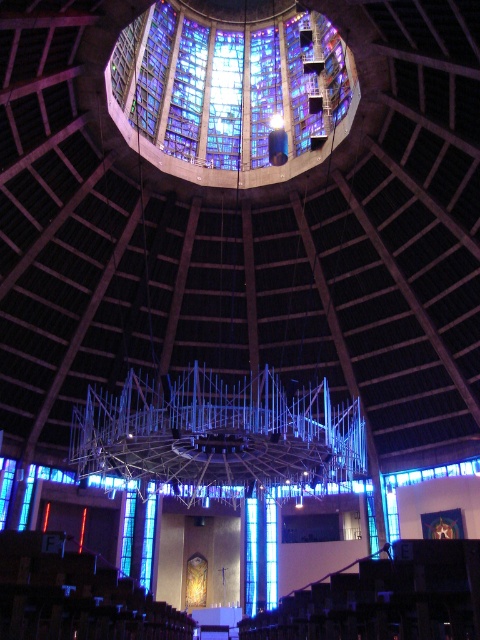
Question: Which of the following is the closest to the observer?

Choices:
 (A) transparent glass window at center
 (B) blue glass window at center
 (C) stained glass at center

Answer: (C)

Question: Is stained glass at center to the left of blue glass window at center from the viewer's perspective?

Choices:
 (A) no
 (B) yes

Answer: (A)

Question: Does stained glass at center have a larger size compared to blue glass window at center?

Choices:
 (A) no
 (B) yes

Answer: (B)

Question: Among these points, which one is farthest from the camera?

Choices:
 (A) (146, 547)
 (B) (291, 26)
 (C) (265, 522)

Answer: (B)

Question: Which point is closer to the camera?

Choices:
 (A) blue glass window at center
 (B) stained glass at center

Answer: (B)

Question: Can you confirm if stained glass at center is positioned to the left of transparent glass window at center?

Choices:
 (A) yes
 (B) no

Answer: (A)